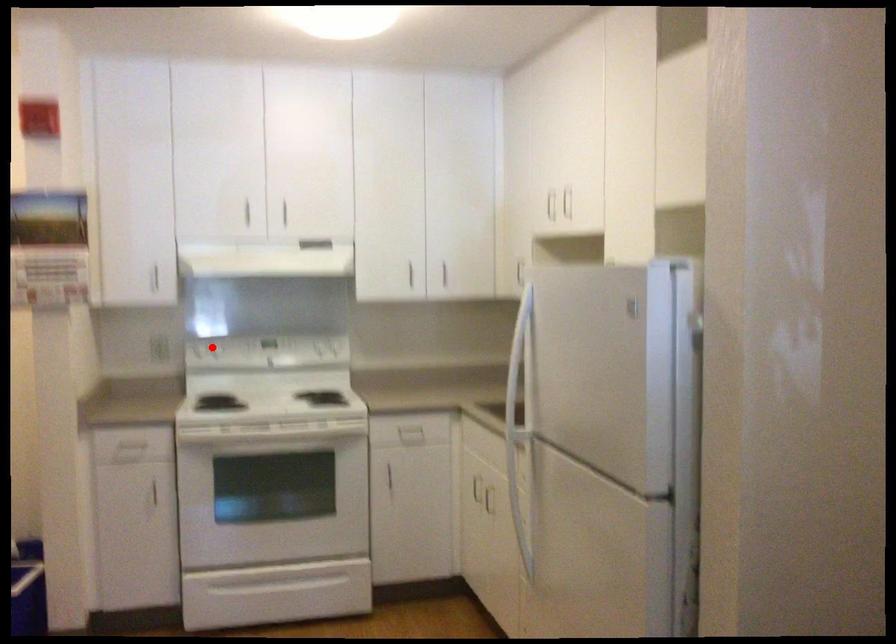
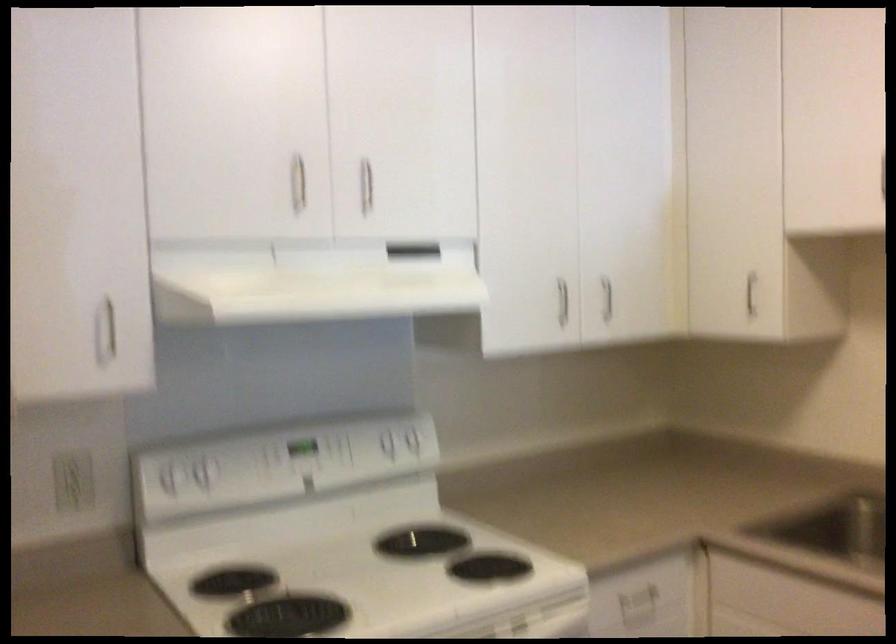
Where in the second image is the point corresponding to the highlighted location from the first image?

(200, 474)